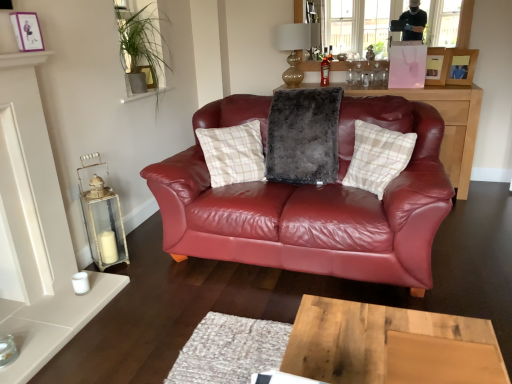
This screenshot has height=384, width=512. In order to click on vacant space to the right of white distressed wood lantern at left in this screenshot , I will do `click(142, 264)`.